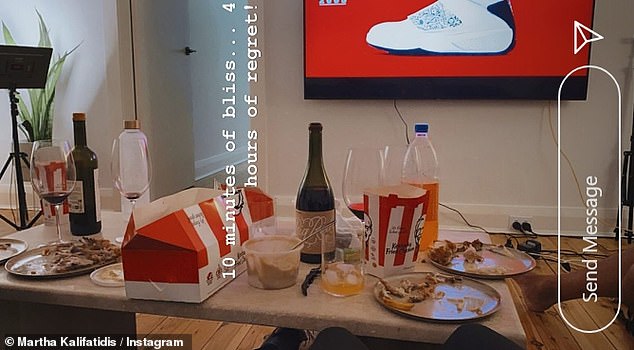
Where is `music stand`? The image size is (634, 350). music stand is located at coordinates (18, 61).